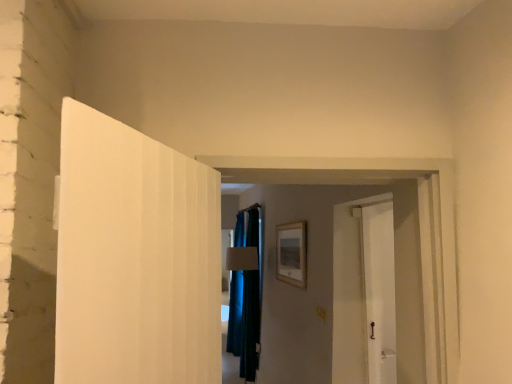
What do you see at coordinates (245, 295) in the screenshot? I see `dark blue fabric at center` at bounding box center [245, 295].

Where is `dark blue fabric at center`? Image resolution: width=512 pixels, height=384 pixels. dark blue fabric at center is located at coordinates (245, 295).

The width and height of the screenshot is (512, 384). Identify the location of wooden picture frame at center. (291, 253).

What do you see at coordinates (291, 253) in the screenshot? I see `wooden picture frame at center` at bounding box center [291, 253].

The image size is (512, 384). I want to click on dark blue fabric at center, so click(x=245, y=295).

Considering the relative positions of dark blue fabric at center and wooden picture frame at center in the image provided, is dark blue fabric at center to the left or to the right of wooden picture frame at center?

Based on their positions, dark blue fabric at center is located to the left of wooden picture frame at center.

Consider the image. Considering the positions of objects dark blue fabric at center and wooden picture frame at center in the image provided, who is behind, dark blue fabric at center or wooden picture frame at center?

dark blue fabric at center is further away from the camera.

Does point (259, 226) come farther from viewer compared to point (298, 256)?

That is True.

From the image's perspective, would you say dark blue fabric at center is positioned over wooden picture frame at center?

No, from the image's perspective, dark blue fabric at center is not above wooden picture frame at center.

From a real-world perspective, is dark blue fabric at center positioned over wooden picture frame at center based on gravity?

Incorrect, from a real-world perspective, dark blue fabric at center is lower than wooden picture frame at center.

Is dark blue fabric at center thinner than wooden picture frame at center?

In fact, dark blue fabric at center might be wider than wooden picture frame at center.

Considering the sizes of objects dark blue fabric at center and wooden picture frame at center in the image provided, who is taller, dark blue fabric at center or wooden picture frame at center?

Standing taller between the two is dark blue fabric at center.

Is dark blue fabric at center smaller than wooden picture frame at center?

Incorrect, dark blue fabric at center is not smaller in size than wooden picture frame at center.

Does dark blue fabric at center contain wooden picture frame at center?

No, wooden picture frame at center is not a part of dark blue fabric at center.

Is dark blue fabric at center placed right next to wooden picture frame at center?

dark blue fabric at center is not next to wooden picture frame at center, and they're not touching.

Is dark blue fabric at center positioned with its back to wooden picture frame at center?

No, dark blue fabric at center is not facing the opposite direction of wooden picture frame at center.

Can you tell me how much dark blue fabric at center and wooden picture frame at center differ in facing direction?

There is a 3-degree angle between the facing directions of dark blue fabric at center and wooden picture frame at center.

I want to click on curtain behind the wooden picture frame at center, so click(245, 295).

Which object is positioned more to the left, wooden picture frame at center or dark blue fabric at center?

dark blue fabric at center is more to the left.

Between wooden picture frame at center and dark blue fabric at center, which one is positioned behind?

Positioned behind is dark blue fabric at center.

Which is nearer, (290, 271) or (254, 375)?

Point (290, 271).

From the image's perspective, does wooden picture frame at center appear higher than dark blue fabric at center?

Yes.

From a real-world perspective, is wooden picture frame at center located higher than dark blue fabric at center?

Correct, in the physical world, wooden picture frame at center is higher than dark blue fabric at center.

Considering the sizes of objects wooden picture frame at center and dark blue fabric at center in the image provided, who is thinner, wooden picture frame at center or dark blue fabric at center?

Thinner between the two is wooden picture frame at center.

Can you confirm if wooden picture frame at center is shorter than dark blue fabric at center?

Yes, wooden picture frame at center is shorter than dark blue fabric at center.

Looking at this image, is wooden picture frame at center smaller than dark blue fabric at center?

Yes.

Looking at this image, is wooden picture frame at center positioned beyond the bounds of dark blue fabric at center?

Yes.

Based on the photo, would you consider wooden picture frame at center to be distant from dark blue fabric at center?

Yes, wooden picture frame at center and dark blue fabric at center are quite far apart.

Is wooden picture frame at center positioned with its back to dark blue fabric at center?

No.

Where is `curtain behind the wooden picture frame at center`? curtain behind the wooden picture frame at center is located at coordinates (245, 295).

Locate an element on the screen. The image size is (512, 384). picture frame in front of the dark blue fabric at center is located at coordinates (291, 253).

Find the location of `curtain on the left of wooden picture frame at center`. curtain on the left of wooden picture frame at center is located at coordinates (245, 295).